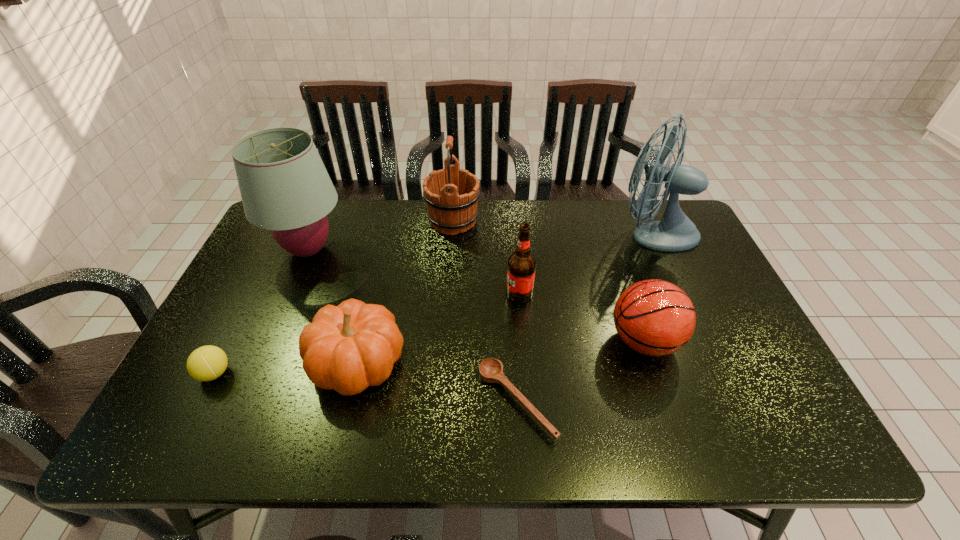
This screenshot has height=540, width=960. I want to click on fan, so click(675, 232).

Identify the location of lampshade. The image size is (960, 540). (285, 188).

Find the location of a particular element. This screenshot has width=960, height=540. the third tallest object is located at coordinates (451, 194).

In order to click on root beer in this screenshot , I will do point(521,268).

The width and height of the screenshot is (960, 540). Find the location of `the fifth shortest object`. the fifth shortest object is located at coordinates (521, 268).

You are a GUI agent. You are given a task and a screenshot of the screen. Output one action in this format:
    pyautogui.click(x=<x>, y=<y>)
    Task: Click on the basketball
    The image size is (960, 540).
    Given the screenshot: What is the action you would take?
    pyautogui.click(x=653, y=317)

This screenshot has height=540, width=960. I want to click on pumpkin, so click(348, 347).

In order to click on the seventh tallest object in this screenshot , I will do `click(206, 363)`.

What are the coordinates of `the shortest object` in the screenshot? It's located at (491, 370).

The width and height of the screenshot is (960, 540). What are the coordinates of `vacant area situated 0.170m in front of the fan to blow air` in the screenshot? It's located at (558, 233).